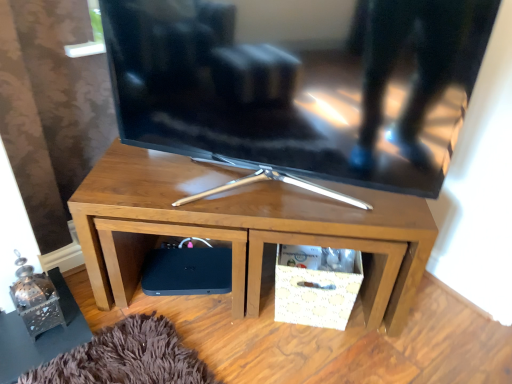
Identify the location of blank space situated above wooden tv stand at center (from a real-world perspective). The image size is (512, 384). (253, 184).